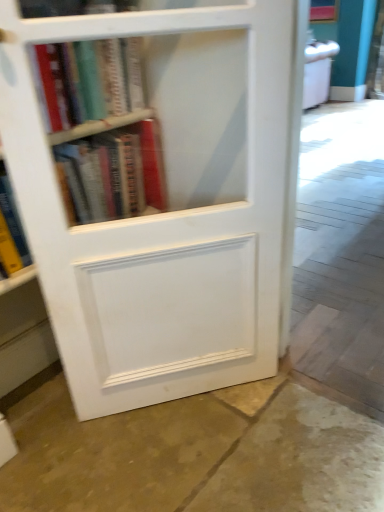
Question: From a real-world perspective, is brown stone floor at lower center on white matte bookcase at center?

Choices:
 (A) yes
 (B) no

Answer: (B)

Question: Is brown stone floor at lower center at the left side of white matte bookcase at center?

Choices:
 (A) yes
 (B) no

Answer: (A)

Question: From a real-world perspective, is brown stone floor at lower center under white matte bookcase at center?

Choices:
 (A) no
 (B) yes

Answer: (B)

Question: Is brown stone floor at lower center completely or partially outside of white matte bookcase at center?

Choices:
 (A) no
 (B) yes

Answer: (B)

Question: Is brown stone floor at lower center directly adjacent to white matte bookcase at center?

Choices:
 (A) yes
 (B) no

Answer: (B)

Question: Does point (102, 222) appear closer or farther from the camera than point (81, 77)?

Choices:
 (A) closer
 (B) farther

Answer: (A)

Question: Looking at their shapes, would you say white matte bookcase at center is wider or thinner than hardcover book at upper left, acting as the 1th book starting from the top?

Choices:
 (A) thin
 (B) wide

Answer: (A)

Question: Considering the positions of white matte bookcase at center and hardcover book at upper left, acting as the 1th book starting from the top, in the image, is white matte bookcase at center bigger or smaller than hardcover book at upper left, acting as the 1th book starting from the top,?

Choices:
 (A) big
 (B) small

Answer: (A)

Question: From a real-world perspective, is white matte bookcase at center physically located above or below hardcover book at upper left, the second book positioned from the bottom?

Choices:
 (A) below
 (B) above

Answer: (A)

Question: From the image's perspective, relative to hardcover books at upper left, placed as the 2th book when sorted from top to bottom, is white matte bookcase at center above or below?

Choices:
 (A) above
 (B) below

Answer: (B)

Question: Considering their positions, is white matte bookcase at center located in front of or behind hardcover books at upper left, placed as the 2th book when sorted from top to bottom?

Choices:
 (A) front
 (B) behind

Answer: (A)

Question: Does point (269, 192) appear closer or farther from the camera than point (104, 166)?

Choices:
 (A) farther
 (B) closer

Answer: (B)

Question: Is white matte bookcase at center wider or thinner than hardcover books at upper left, placed as the 2th book when sorted from top to bottom?

Choices:
 (A) thin
 (B) wide

Answer: (A)

Question: Is point (129, 49) closer or farther from the camera than point (54, 59)?

Choices:
 (A) farther
 (B) closer

Answer: (A)

Question: Is hardcover book at upper left, acting as the 1th book starting from the top, in front of or behind white matte bookcase at center in the image?

Choices:
 (A) behind
 (B) front

Answer: (A)